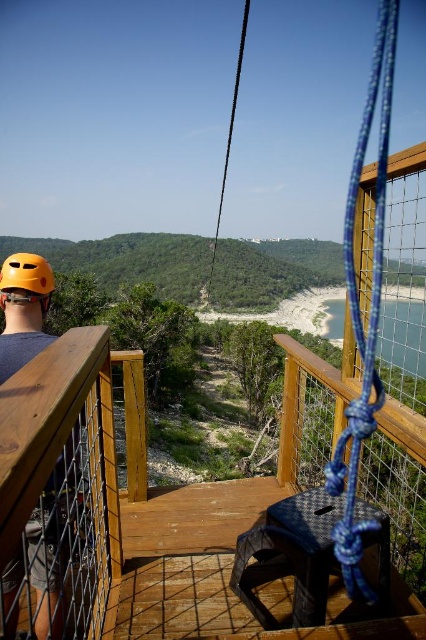
Which is behind, point (244, 529) or point (37, 257)?

The point (244, 529) is more distant.

Which is more to the left, wooden at upper center or yellow matte helmet at upper left?

Positioned to the left is yellow matte helmet at upper left.

Where is `wooden at upper center`? wooden at upper center is located at coordinates (144, 518).

Identify the location of wooden at upper center. (144, 518).

Can you confirm if matte yellow helmet at left is taller than yellow matte helmet at upper left?

In fact, matte yellow helmet at left may be shorter than yellow matte helmet at upper left.

Between matte yellow helmet at left and yellow matte helmet at upper left, which one is positioned higher?

yellow matte helmet at upper left is higher up.

Is point (60, 515) behind point (42, 310)?

No, it is in front of (42, 310).

In order to click on matte yellow helmet at left in this screenshot , I will do `click(23, 308)`.

Can you confirm if wooden at upper center is taller than matte yellow helmet at left?

In fact, wooden at upper center may be shorter than matte yellow helmet at left.

The image size is (426, 640). What do you see at coordinates (144, 518) in the screenshot?
I see `wooden at upper center` at bounding box center [144, 518].

Image resolution: width=426 pixels, height=640 pixels. I want to click on wooden at upper center, so click(144, 518).